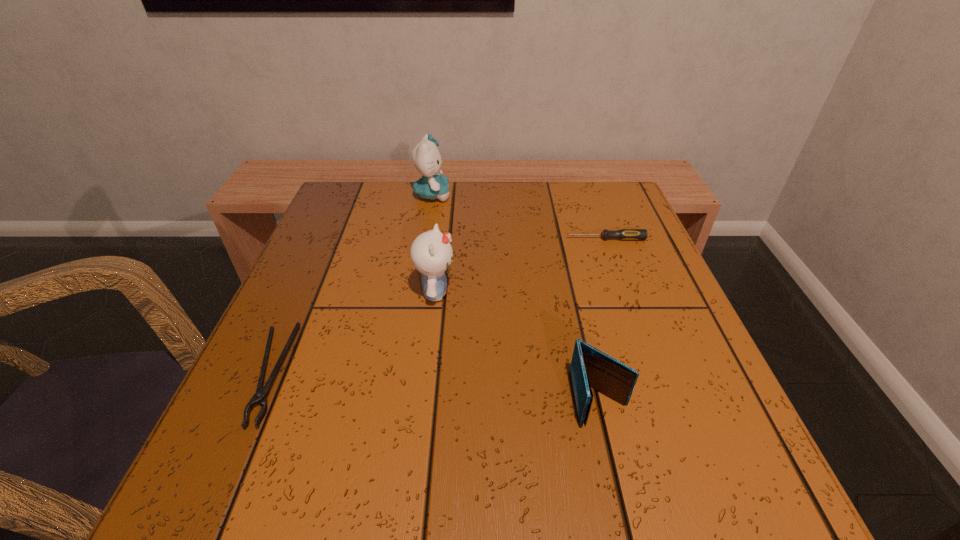
The width and height of the screenshot is (960, 540). Identify the location of free space at the left edge of the desktop. 295,314.

Locate an element on the screen. vacant space at the right edge of the desktop is located at coordinates (615, 252).

Where is `free point at the far left corner`? free point at the far left corner is located at coordinates (335, 200).

I want to click on vacant space at the near left corner of the desktop, so click(218, 483).

Where is `vacant space at the far right corner of the desktop`? The image size is (960, 540). vacant space at the far right corner of the desktop is located at coordinates (632, 219).

The height and width of the screenshot is (540, 960). Identify the location of free space at the near right corner of the desktop. (703, 450).

Locate an element on the screen. This screenshot has height=540, width=960. vacant region between the wallet and the third nearest object is located at coordinates (517, 346).

This screenshot has height=540, width=960. I want to click on vacant space in between the farthest object and the wallet, so click(516, 297).

Where is `vacant space that's between the second shortest object and the farthest object`? vacant space that's between the second shortest object and the farthest object is located at coordinates [x=518, y=217].

The image size is (960, 540). I want to click on free spot between the fourth tallest object and the farthest object, so click(x=518, y=217).